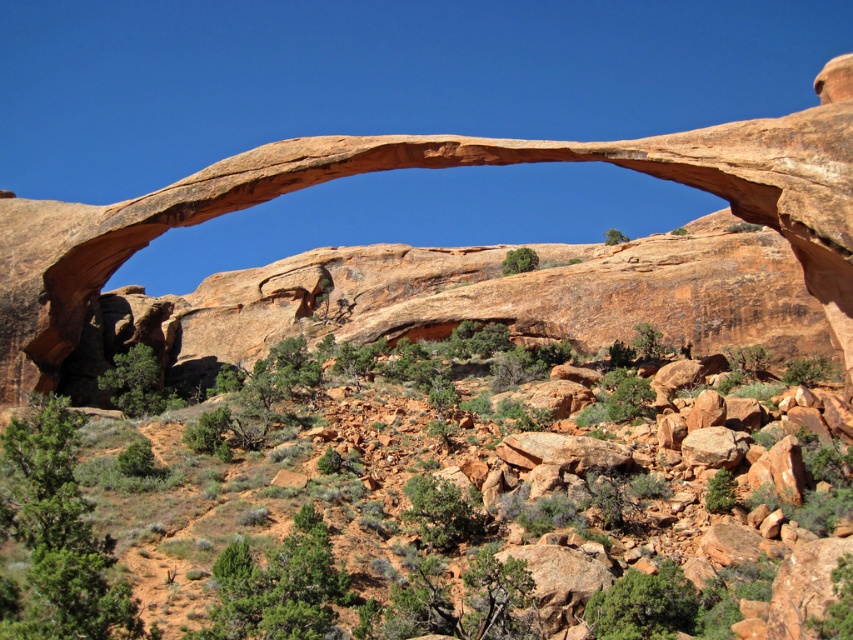
You are a hiker standing at the base of the rustic stone arch at center. You want to take a photo of the arch with your smartphone, which has a maximum focus range of 50 meters. Will the smartphone be able to focus on the arch?

The rustic stone arch at center is 58.85 meters away from the viewer. Since the smartphone has a maximum focus range of 50 meters, it cannot focus on the arch as it is beyond the 50 meter limit.

You are a hiker standing at the base of the two arches. You want to take a photo that captures both the rustic stone arch at center and the rustic sandstone arch at center in the same frame. Which arch should you position closer to the camera to ensure both are visible?

To capture both the rustic stone arch at center and the rustic sandstone arch at center in the same frame, you should position the rustic stone arch at center closer to the camera since it is in front of the rustic sandstone arch at center.